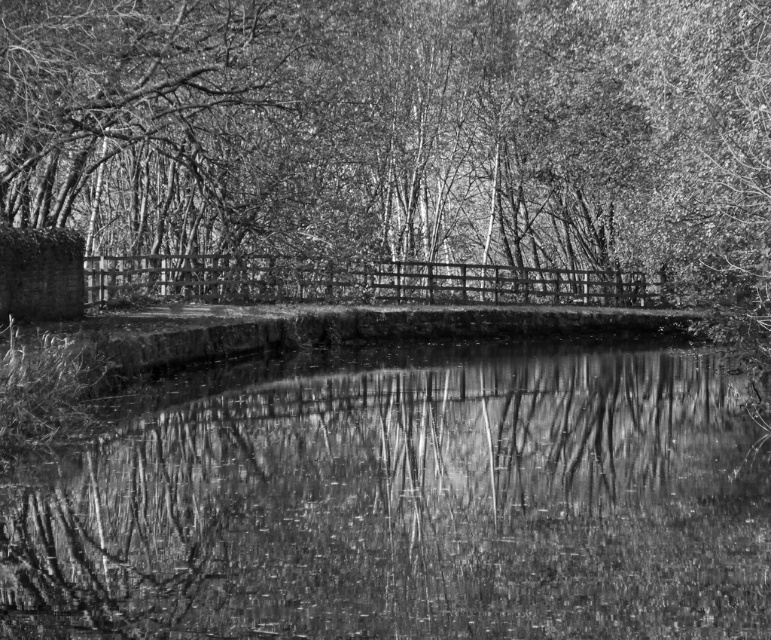
Question: From the image, what is the correct spatial relationship of smooth water at center in relation to wooden bridge at center?

Choices:
 (A) right
 (B) left

Answer: (A)

Question: Which point is closer to the camera?

Choices:
 (A) (342, 300)
 (B) (210, 632)
 (C) (687, 282)

Answer: (B)

Question: Is rough bark tree at center smaller than smooth water at center?

Choices:
 (A) yes
 (B) no

Answer: (B)

Question: Can you confirm if smooth water at center is wider than wooden bridge at center?

Choices:
 (A) no
 (B) yes

Answer: (A)

Question: Which is nearer to the smooth water at center?

Choices:
 (A) wooden bridge at center
 (B) rough bark tree at center

Answer: (B)

Question: Which is farther from the wooden bridge at center?

Choices:
 (A) smooth water at center
 (B) rough bark tree at center

Answer: (A)